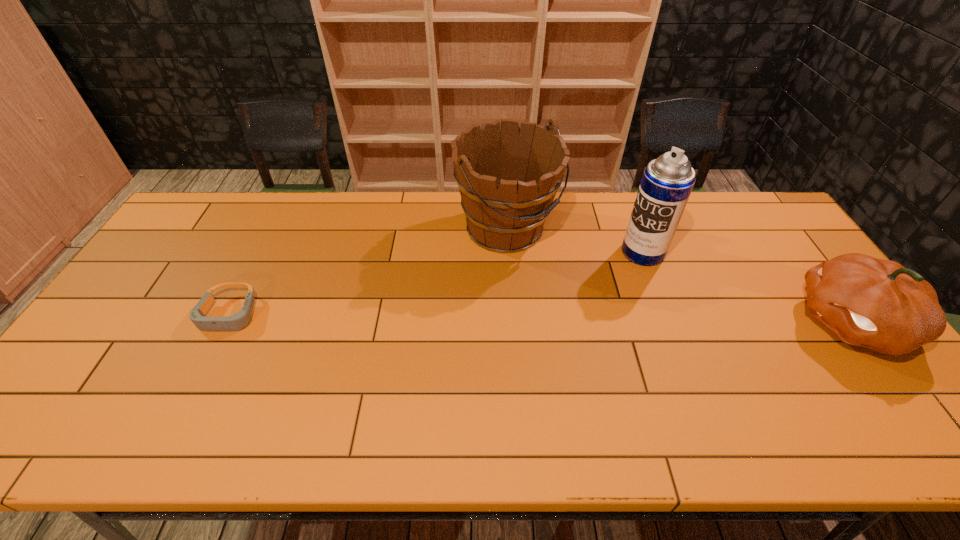
Image resolution: width=960 pixels, height=540 pixels. I want to click on free space between the second object from left to right and the leftmost object, so click(x=369, y=272).

The height and width of the screenshot is (540, 960). What are the coordinates of `free space between the aerosol can and the second object from left to right` in the screenshot? It's located at (575, 241).

What are the coordinates of `free space between the rightmost object and the third object from left to right` in the screenshot? It's located at (747, 287).

I want to click on object that can be found as the third closest to the wine bucket, so click(x=879, y=304).

Point out which object is positioned as the nearest to the leftmost object. Please provide its 2D coordinates. Your answer should be formatted as a tuple, i.e. [(x, y)], where the tuple contains the x and y coordinates of a point satisfying the conditions above.

[(507, 180)]

Find the location of a particular element. The width and height of the screenshot is (960, 540). vacant space that satisfies the following two spatial constraints: 1. on the front side of the rightmost object; 2. on the front face of the second object from right to left is located at coordinates (669, 322).

Where is `vacant space that satisfies the following two spatial constraints: 1. on the front and back of the third tallest object; 2. on the front face of the shortest object`? vacant space that satisfies the following two spatial constraints: 1. on the front and back of the third tallest object; 2. on the front face of the shortest object is located at coordinates point(226,322).

At what (x,y) coordinates should I click in order to perform the action: click on vacant space that satisfies the following two spatial constraints: 1. on the front side of the aerosol can; 2. on the front face of the rightmost object. Please return your answer as a coordinate pair (x, y). Image resolution: width=960 pixels, height=540 pixels. Looking at the image, I should click on (669, 322).